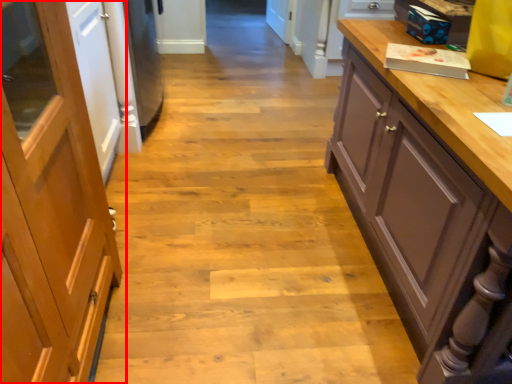
Question: From the image's perspective, what is the correct spatial positioning of cabinetry (annotated by the red box) in reference to cupboard?

Choices:
 (A) below
 (B) above

Answer: (A)